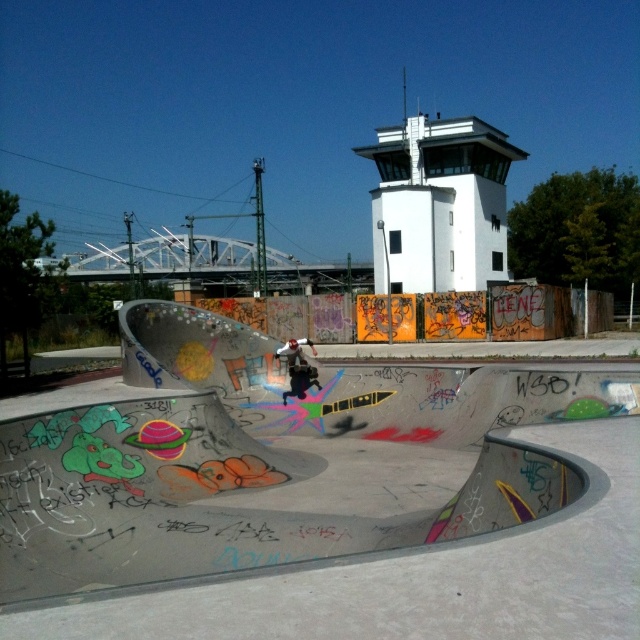
Question: Which of these objects is positioned closest to the white smooth control tower at upper center?

Choices:
 (A) concrete skate park at center
 (B) blue glossy skateboard at center

Answer: (A)

Question: Based on their relative distances, which object is nearer to the blue glossy skateboard at center?

Choices:
 (A) white smooth control tower at upper center
 (B) concrete skate park at center

Answer: (B)

Question: Can you confirm if concrete skate park at center is positioned below white smooth control tower at upper center?

Choices:
 (A) no
 (B) yes

Answer: (B)

Question: Is concrete skate park at center to the left of white smooth control tower at upper center from the viewer's perspective?

Choices:
 (A) yes
 (B) no

Answer: (A)

Question: Which object is positioned closest to the blue glossy skateboard at center?

Choices:
 (A) concrete skate park at center
 (B) white smooth control tower at upper center

Answer: (A)

Question: Observing the image, what is the correct spatial positioning of white smooth control tower at upper center in reference to blue glossy skateboard at center?

Choices:
 (A) right
 (B) left

Answer: (A)